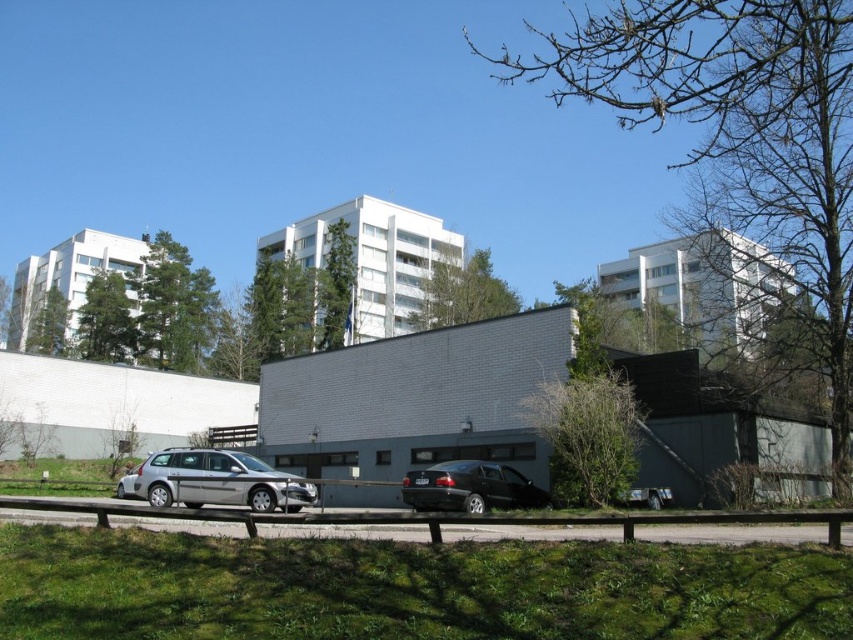
Question: Is silver metallic station wagon at center smaller than black glossy car at center?

Choices:
 (A) no
 (B) yes

Answer: (A)

Question: Can you confirm if silver metallic station wagon at center is smaller than black glossy car at center?

Choices:
 (A) no
 (B) yes

Answer: (A)

Question: Which point is closer to the camera?

Choices:
 (A) black glossy car at center
 (B) silver metallic station wagon at center

Answer: (B)

Question: Which object appears closest to the camera in this image?

Choices:
 (A) black glossy car at center
 (B) silver metallic station wagon at center

Answer: (B)

Question: Observing the image, what is the correct spatial positioning of silver metallic station wagon at center in reference to black glossy car at center?

Choices:
 (A) right
 (B) left

Answer: (B)

Question: Among these objects, which one is nearest to the camera?

Choices:
 (A) silver metallic station wagon at center
 (B) black glossy car at center

Answer: (A)